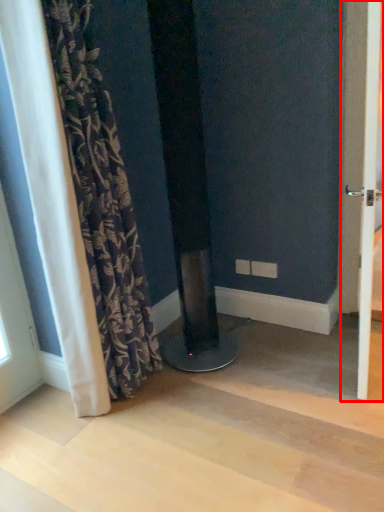
Question: In this image, where is screen door (annotated by the red box) located relative to curtain?

Choices:
 (A) left
 (B) right

Answer: (B)